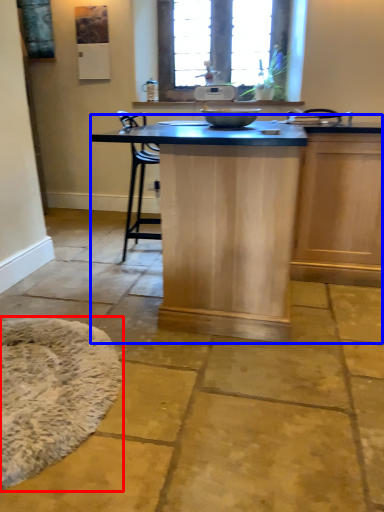
Question: Which point is closer to the camera, mat (highlighted by a red box) or table (highlighted by a blue box)?

Choices:
 (A) mat
 (B) table

Answer: (A)